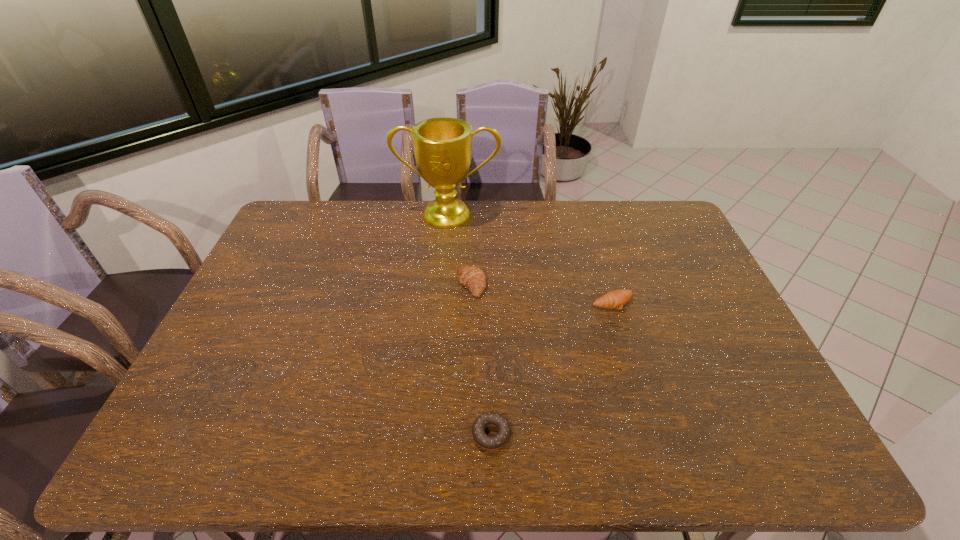
Image resolution: width=960 pixels, height=540 pixels. Identify the location of the tallest object. (442, 146).

Where is `the farthest object`? The width and height of the screenshot is (960, 540). the farthest object is located at coordinates (442, 146).

Locate an element on the screen. The image size is (960, 540). the left crescent roll is located at coordinates (472, 277).

The image size is (960, 540). What are the coordinates of `the taller crescent roll` in the screenshot? It's located at point(472,277).

At what (x,y) coordinates should I click in order to perform the action: click on the right crescent roll. Please return your answer as a coordinate pair (x, y). The height and width of the screenshot is (540, 960). Looking at the image, I should click on (616, 299).

In order to click on the rightmost object in this screenshot , I will do `click(616, 299)`.

Where is `the shortest object`? This screenshot has width=960, height=540. the shortest object is located at coordinates (490, 443).

Locate an element on the screen. The width and height of the screenshot is (960, 540). the nearest object is located at coordinates (490, 443).

Image resolution: width=960 pixels, height=540 pixels. Find the location of `free space located 0.100m on the shiny surface of the tallest object`. free space located 0.100m on the shiny surface of the tallest object is located at coordinates (445, 248).

Identify the location of vacant space located 0.160m on the right of the second tallest object. (538, 285).